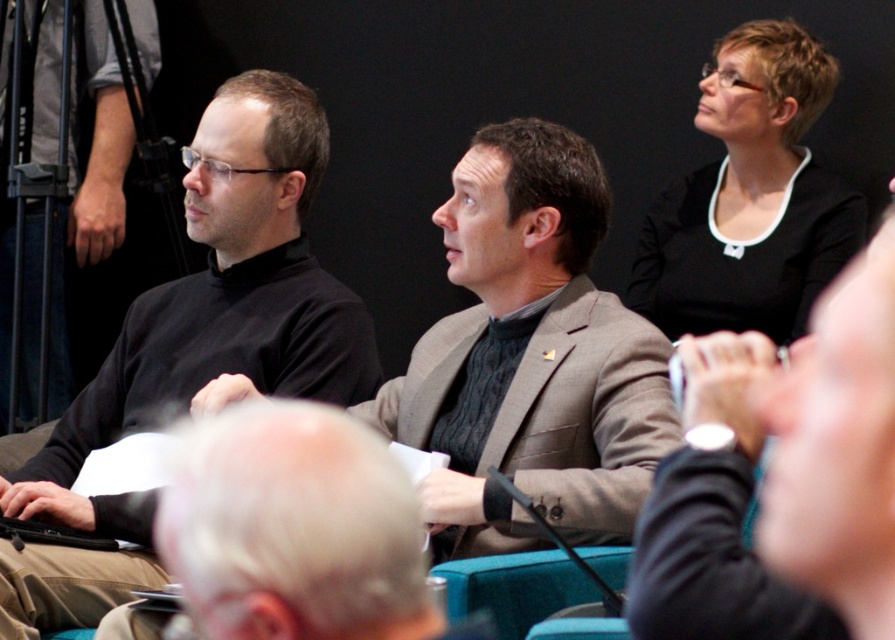
You are organizing a photo shoot and need to ensure that the black turtleneck sweater at center and the black matte shirt at upper right are visible in the final image. Given their sizes, which one might require more careful framing to ensure it stands out?

The black turtleneck sweater at center has a larger size compared to the black matte shirt at upper right, so it might require more careful framing to ensure it stands out.

Looking at the image, where is the black turtleneck sweater at center in relation to the black matte shirt at upper right?

The black turtleneck sweater at center is to the left of the black matte shirt at upper right.

You are a photographer setting up for a group photo. You need to position two black items, the black jersey at upper right and the black matte shirt at upper right, so that they are exactly 1.5 meters apart for better visibility. Based on the current setup in the image, do you need to move them closer or farther apart?

The black jersey at upper right and black matte shirt at upper right are currently 1.47 meters apart. Since 1.47 meters is less than 1.5 meters, you need to move them slightly farther apart to achieve the desired distance.